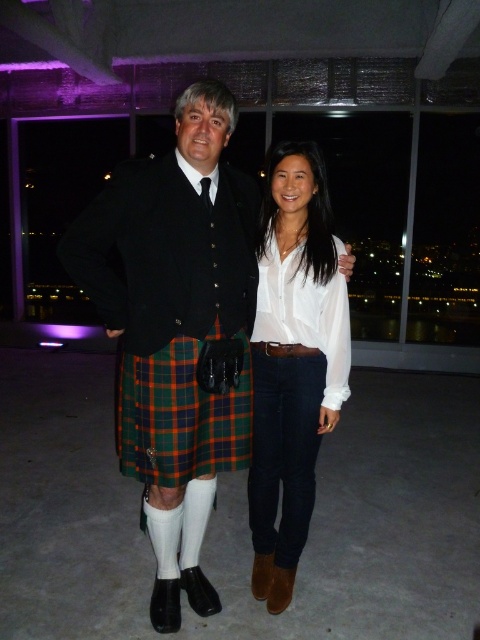
You are a photographer at the event and want to ensure both the tartan kilt at center and the white satin blouse at center are clearly visible in the photo. Based on their positions, which one is positioned higher in the frame?

The tartan kilt at center is located above the white satin blouse at center, so it is positioned higher in the frame.

You are a photographer at an event and need to ensure both the tartan kilt at center and the white satin blouse at center are fully visible in a vertical portrait shot. Given that the camera frame can only accommodate one of the two items in its width, which item should you prioritize to fit within the frame?

The white satin blouse at center should be prioritized because the tartan kilt at center is wider than the white satin blouse at center, making the blouse more likely to fit within the narrower vertical frame.